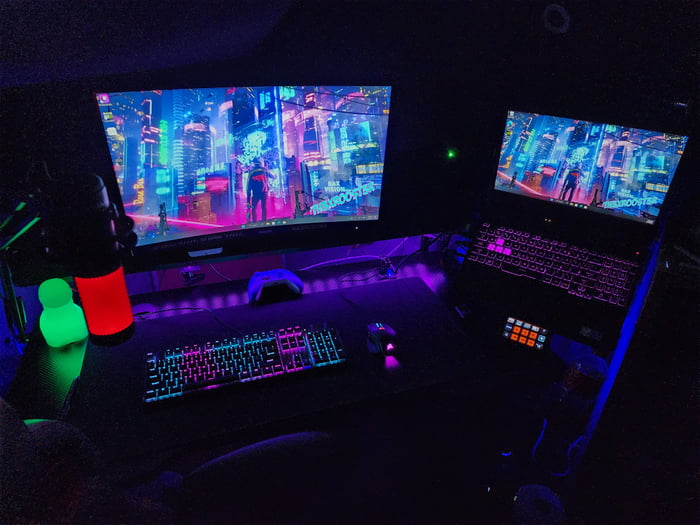
The width and height of the screenshot is (700, 525). What are the coordinates of `screen` in the screenshot? It's located at (304, 178), (617, 171).